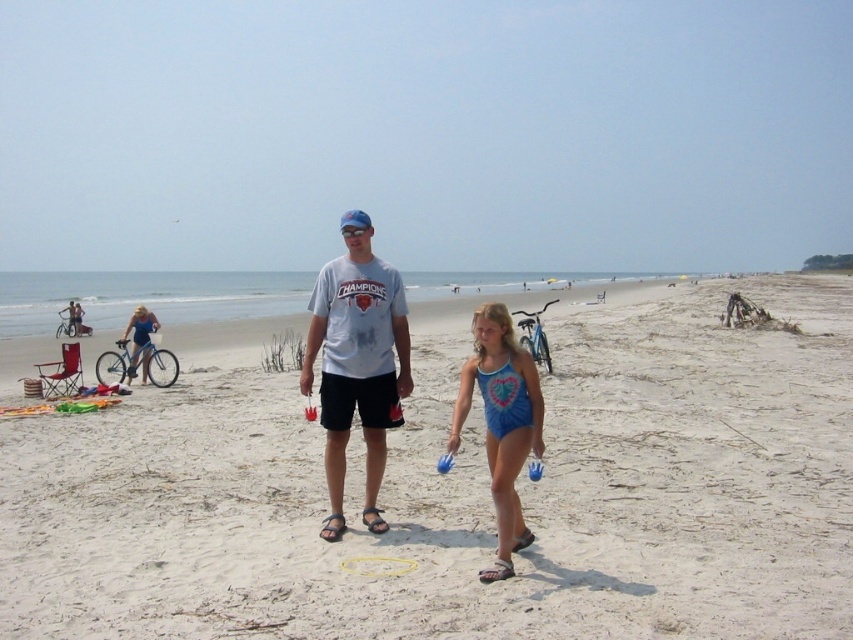
You are standing at the point with coordinates (x=465, y=493). Based on the scene description, what is the terrain like at your current location?

The terrain at point (x=465, y=493) is white sandy beach at center.